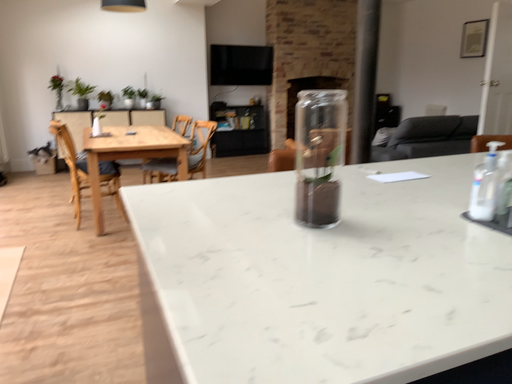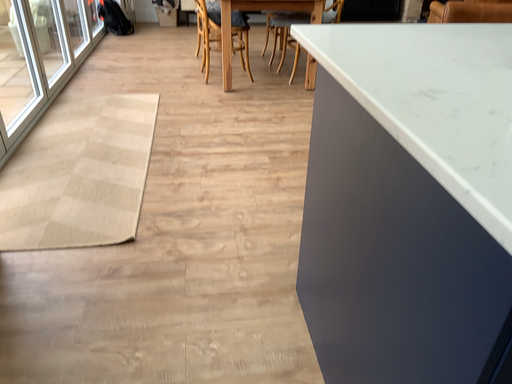
Question: Which way did the camera rotate in the video?

Choices:
 (A) rotated upward
 (B) rotated downward

Answer: (B)